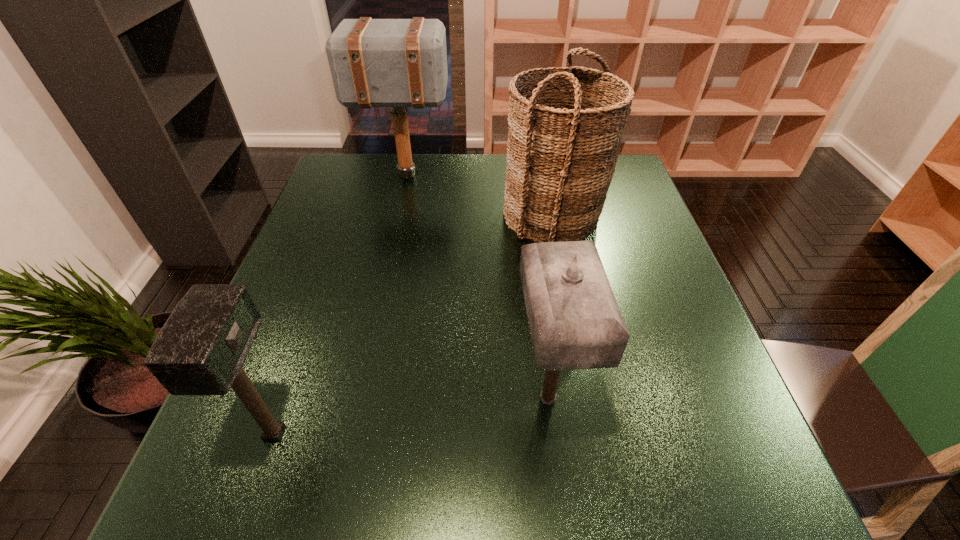
Find the location of a particular element. This screenshot has width=960, height=540. object situated at the near edge is located at coordinates (200, 350).

The image size is (960, 540). I want to click on object present at the right edge, so click(x=565, y=130).

In order to click on object that is positioned at the far left corner in this screenshot , I will do `click(398, 63)`.

Where is `object at the near left corner`? object at the near left corner is located at coordinates (200, 350).

You are a GUI agent. You are given a task and a screenshot of the screen. Output one action in this format:
    pyautogui.click(x=<x>, y=<y>)
    Task: Click on the object that is at the far right corner
    Image resolution: width=960 pixels, height=540 pixels.
    Given the screenshot: What is the action you would take?
    pyautogui.click(x=565, y=130)

Locate an element on the screen. The height and width of the screenshot is (540, 960). vacant region at the far edge of the desktop is located at coordinates (394, 158).

The width and height of the screenshot is (960, 540). Find the location of `vacant area at the near edge`. vacant area at the near edge is located at coordinates (607, 488).

At what (x,y) coordinates should I click in order to perform the action: click on free space at the left edge of the desktop. Please return your answer as a coordinate pair (x, y). Looking at the image, I should click on (319, 258).

In the image, there is a desktop. Identify the location of vacant space at the right edge. Image resolution: width=960 pixels, height=540 pixels. (667, 261).

Identify the location of free space at the far left corner. Image resolution: width=960 pixels, height=540 pixels. (377, 169).